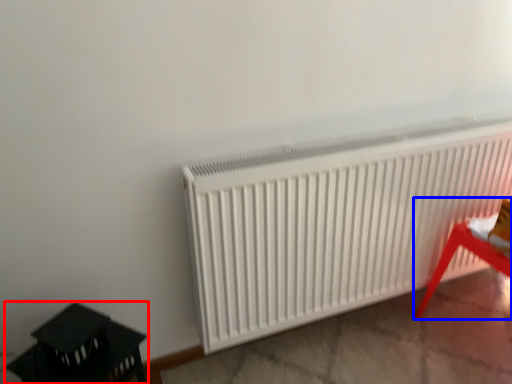
Question: Which object is further to the camera taking this photo, furniture (highlighted by a red box) or furniture (highlighted by a blue box)?

Choices:
 (A) furniture
 (B) furniture

Answer: (B)